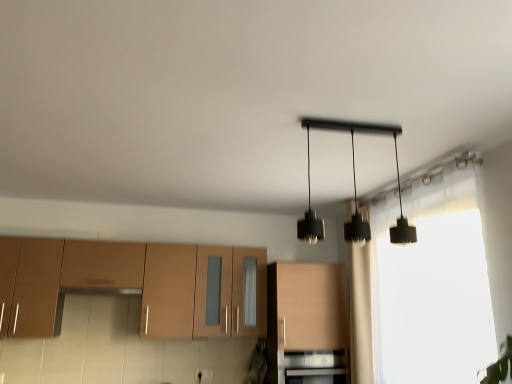
Question: From the image's perspective, is brown matte cabinet at lower left, marked as the 1th cabinetry in a left-to-right arrangement, located above beige fabric curtain at center-right?

Choices:
 (A) no
 (B) yes

Answer: (A)

Question: Is the position of brown matte cabinet at lower left, the second cabinetry in the right-to-left sequence, more distant than that of beige fabric curtain at center-right?

Choices:
 (A) no
 (B) yes

Answer: (A)

Question: Is brown matte cabinet at lower left, the second cabinetry in the right-to-left sequence, thinner than beige fabric curtain at center-right?

Choices:
 (A) yes
 (B) no

Answer: (B)

Question: Is brown matte cabinet at lower left, marked as the 1th cabinetry in a left-to-right arrangement, surrounding beige fabric curtain at center-right?

Choices:
 (A) yes
 (B) no

Answer: (B)

Question: From a real-world perspective, is brown matte cabinet at lower left, marked as the 1th cabinetry in a left-to-right arrangement, on top of beige fabric curtain at center-right?

Choices:
 (A) yes
 (B) no

Answer: (B)

Question: Considering the relative positions of brown matte cabinet at lower left, marked as the 1th cabinetry in a left-to-right arrangement, and beige fabric curtain at center-right in the image provided, is brown matte cabinet at lower left, marked as the 1th cabinetry in a left-to-right arrangement, to the left of beige fabric curtain at center-right from the viewer's perspective?

Choices:
 (A) no
 (B) yes

Answer: (B)

Question: Can you confirm if brown matte cabinet at lower left, the second cabinetry in the right-to-left sequence, is smaller than black matte oven at lower center?

Choices:
 (A) no
 (B) yes

Answer: (A)

Question: Does brown matte cabinet at lower left, marked as the 1th cabinetry in a left-to-right arrangement, lie in front of black matte oven at lower center?

Choices:
 (A) no
 (B) yes

Answer: (B)

Question: Could you tell me if brown matte cabinet at lower left, marked as the 1th cabinetry in a left-to-right arrangement, is turned towards black matte oven at lower center?

Choices:
 (A) yes
 (B) no

Answer: (B)

Question: From the image's perspective, would you say brown matte cabinet at lower left, the second cabinetry in the right-to-left sequence, is positioned over black matte oven at lower center?

Choices:
 (A) yes
 (B) no

Answer: (A)

Question: Is brown matte cabinet at lower left, the second cabinetry in the right-to-left sequence, directly adjacent to black matte oven at lower center?

Choices:
 (A) no
 (B) yes

Answer: (A)

Question: Is brown matte cabinet at lower left, the second cabinetry in the right-to-left sequence, further to camera compared to black matte oven at lower center?

Choices:
 (A) no
 (B) yes

Answer: (A)

Question: Could black matte pendant lights at center be considered to be inside brown matte cabinet at lower left, marked as the 1th cabinetry in a left-to-right arrangement?

Choices:
 (A) yes
 (B) no

Answer: (B)